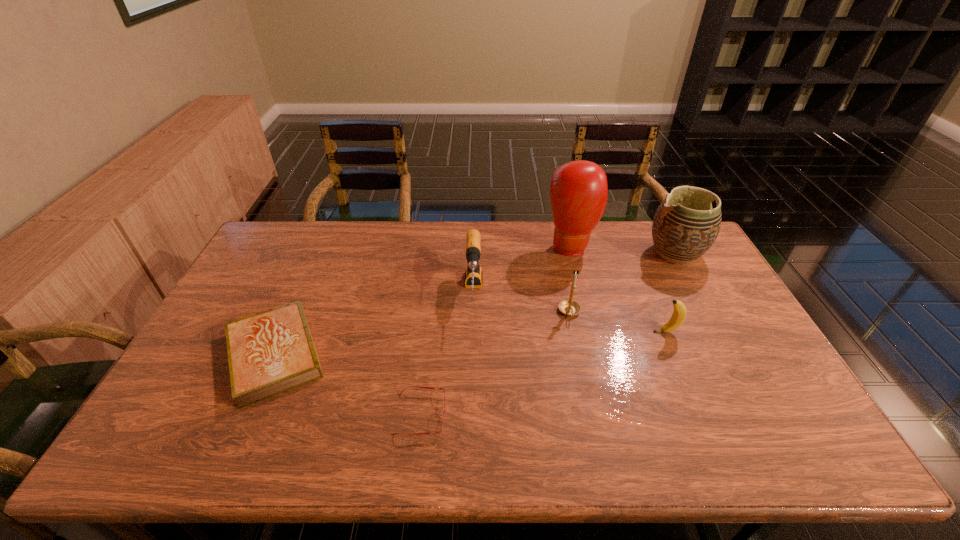
This screenshot has width=960, height=540. Identify the location of vacant space at the far left corner of the desktop. (254, 256).

Find the location of a particular element. The height and width of the screenshot is (540, 960). free spot between the tallest object and the second object from left to right is located at coordinates (496, 330).

Locate an element on the screen. vacant area that lies between the rightmost object and the banana is located at coordinates (671, 293).

Locate an element on the screen. Image resolution: width=960 pixels, height=540 pixels. unoccupied position between the candle holder and the sixth tallest object is located at coordinates (422, 333).

This screenshot has width=960, height=540. Find the location of `free spot between the fifth object from right to left and the tallest object`. free spot between the fifth object from right to left and the tallest object is located at coordinates (522, 269).

You are a GUI agent. You are given a task and a screenshot of the screen. Output one action in this format:
    pyautogui.click(x=<x>, y=<y>)
    Task: Click on the unoccupied area between the banana and the second tallest object
    
    Given the screenshot: What is the action you would take?
    pyautogui.click(x=671, y=293)

This screenshot has width=960, height=540. In order to click on free space between the hardback book and the rightmost object in this screenshot , I will do `click(475, 303)`.

Where is `empty location between the leftmost object and the tallest object`? The height and width of the screenshot is (540, 960). empty location between the leftmost object and the tallest object is located at coordinates (x=422, y=300).

Identify the location of vacant area that lies between the shortest object and the fifth object from right to left. (447, 353).

Identify the location of free area in between the second shortest object and the pottery. (475, 303).